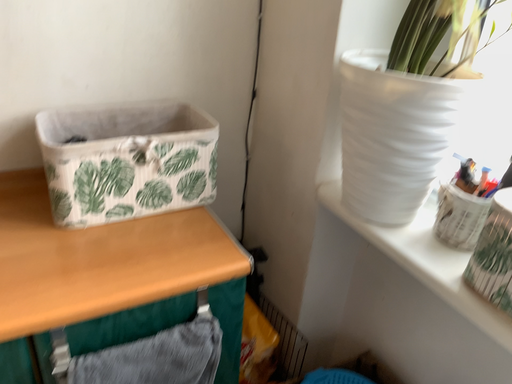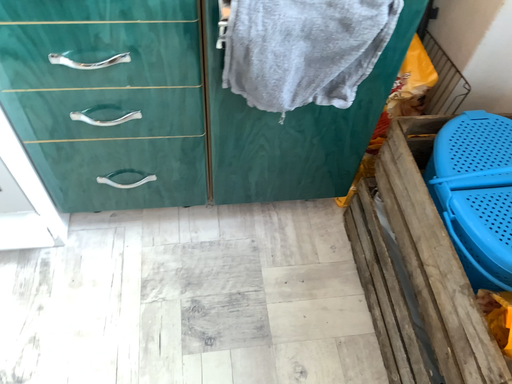
Question: How did the camera likely rotate when shooting the video?

Choices:
 (A) rotated downward
 (B) rotated upward

Answer: (A)